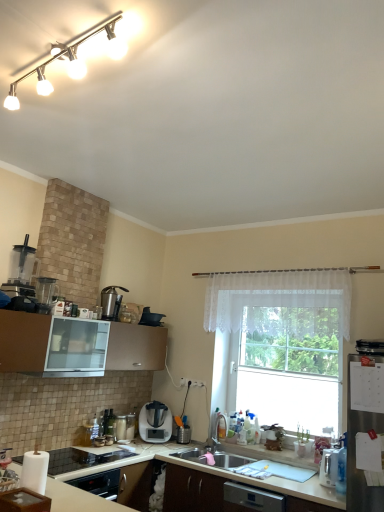
Question: Would you say brown matte cabinet at lower left is part of metallic silver toaster at lower left, the 4th appliance in the top-to-bottom sequence,'s contents?

Choices:
 (A) no
 (B) yes

Answer: (A)

Question: Does metallic silver toaster at lower left, which is the third appliance in back-to-front order, appear on the left side of brown matte cabinet at lower left?

Choices:
 (A) no
 (B) yes

Answer: (B)

Question: From a real-world perspective, is metallic silver toaster at lower left, which is counted as the second appliance, starting from the bottom, on top of brown matte cabinet at lower left?

Choices:
 (A) yes
 (B) no

Answer: (B)

Question: Can you confirm if metallic silver toaster at lower left, which is counted as the second appliance, starting from the bottom, is taller than brown matte cabinet at lower left?

Choices:
 (A) yes
 (B) no

Answer: (B)

Question: From a real-world perspective, is metallic silver toaster at lower left, which is the third appliance in back-to-front order, beneath brown matte cabinet at lower left?

Choices:
 (A) no
 (B) yes

Answer: (B)

Question: Is satin silver blender at center, marked as the first home appliance in a back-to-front arrangement, inside the boundaries of white matte countertop at lower center, placed as the second countertop when sorted from top to bottom, or outside?

Choices:
 (A) inside
 (B) outside

Answer: (B)

Question: Is satin silver blender at center, placed as the second home appliance when sorted from top to bottom, in front of or behind white matte countertop at lower center, the first countertop positioned from the bottom, in the image?

Choices:
 (A) front
 (B) behind

Answer: (B)

Question: Considering the relative positions of satin silver blender at center, the 1th home appliance when ordered from right to left, and white matte countertop at lower center, placed as the second countertop when sorted from top to bottom, in the image provided, is satin silver blender at center, the 1th home appliance when ordered from right to left, to the left or to the right of white matte countertop at lower center, placed as the second countertop when sorted from top to bottom,?

Choices:
 (A) left
 (B) right

Answer: (A)

Question: Is point (150, 437) closer or farther from the camera than point (332, 492)?

Choices:
 (A) closer
 (B) farther

Answer: (B)

Question: Is point (125, 415) closer or farther from the camera than point (182, 379)?

Choices:
 (A) closer
 (B) farther

Answer: (A)

Question: Would you say white glossy blender at lower center, placed as the 1th appliance when sorted from bottom to top, is inside or outside white plastic electric outlet at center?

Choices:
 (A) outside
 (B) inside

Answer: (A)

Question: From a real-world perspective, relative to white plastic electric outlet at center, is white glossy blender at lower center, marked as the third appliance in a left-to-right arrangement, vertically above or below?

Choices:
 (A) above
 (B) below

Answer: (B)

Question: Is white glossy blender at lower center, which is counted as the 3th appliance, starting from the right, bigger or smaller than white plastic electric outlet at center?

Choices:
 (A) big
 (B) small

Answer: (A)

Question: In the image, is satin silver blender at center, marked as the first home appliance in a back-to-front arrangement, on the left side or the right side of white glossy blender at lower center, which is counted as the 3th appliance, starting from the right?

Choices:
 (A) right
 (B) left

Answer: (A)

Question: Which is correct: satin silver blender at center, which ranks as the second home appliance in front-to-back order, is inside white glossy blender at lower center, which appears as the 2th appliance when viewed from the back, or outside of it?

Choices:
 (A) inside
 (B) outside

Answer: (B)